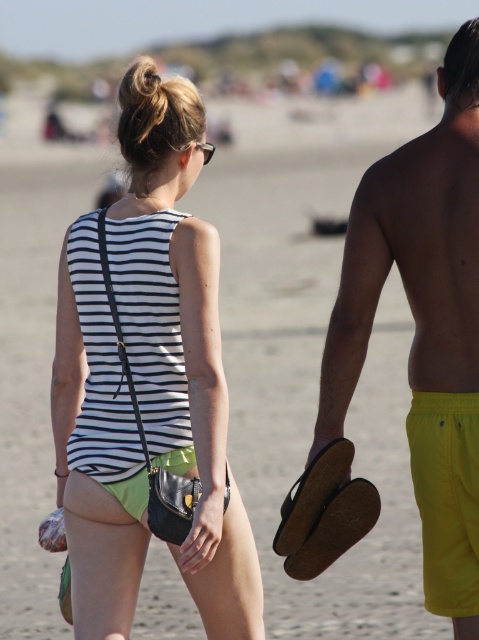
You are standing at the beach and see the striped fabric tank top at center. Where is it positioned relative to the other objects in the scene?

The striped fabric tank top at center is located at point 0.530 on the x axis and 0.376 on the y axis.

Based on the scene description, where is the yellow fabric shorts at right located in the image?

The yellow fabric shorts at right is located at point 0.506 on the x axis and 0.887 on the y axis.

You are a photographer trying to capture the two people in the image. If you want to focus on the striped fabric tank top at center and the yellow fabric shorts at right, which one should you adjust your camera to the left to include in the frame?

Since the striped fabric tank top at center is to the left of yellow fabric shorts at right, you should adjust your camera to the left to include the striped fabric tank top at center in the frame.